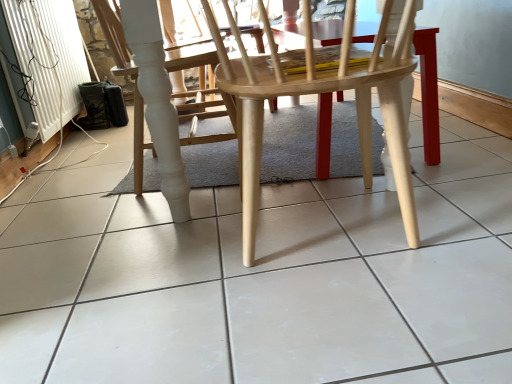
Locate an element on the screen. free space between natural wood chair at center, the second chair when ordered from left to right, and white glossy chair at center, arranged as the second chair when viewed from the front is located at coordinates (226, 211).